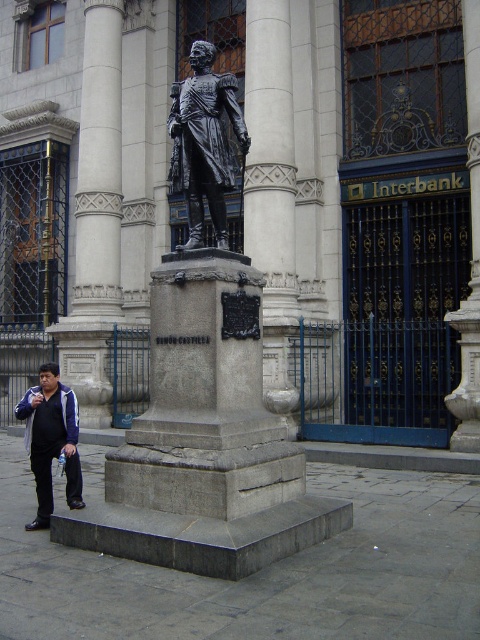
Question: Can you confirm if bronze statue at center is bigger than polished bronze pillar at center?

Choices:
 (A) no
 (B) yes

Answer: (B)

Question: Which of the following is the closest to the observer?

Choices:
 (A) dark blue jacket at lower left
 (B) bronze statue at center
 (C) black polished statue at center

Answer: (C)

Question: Based on their relative distances, which object is farther from the polished bronze pillar at center?

Choices:
 (A) black polished statue at center
 (B) dark blue jacket at lower left
 (C) bronze statue at center

Answer: (B)

Question: Can you confirm if gray stone column at center is bigger than polished bronze pillar at center?

Choices:
 (A) no
 (B) yes

Answer: (B)

Question: Which point is closer to the camera?

Choices:
 (A) polished bronze pillar at center
 (B) bronze statue at center
 (C) gray stone column at center

Answer: (B)

Question: Observing the image, what is the correct spatial positioning of polished bronze pillar at center in reference to dark blue jacket at lower left?

Choices:
 (A) below
 (B) above

Answer: (B)